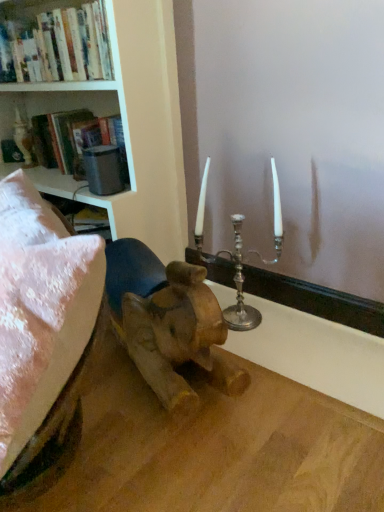
Question: Does white painted wood bookcase at upper left lie behind silver metallic candlestick at upper center?

Choices:
 (A) yes
 (B) no

Answer: (B)

Question: From a real-world perspective, is white painted wood bookcase at upper left on silver metallic candlestick at upper center?

Choices:
 (A) yes
 (B) no

Answer: (A)

Question: Is white painted wood bookcase at upper left next to silver metallic candlestick at upper center?

Choices:
 (A) no
 (B) yes

Answer: (A)

Question: Is silver metallic candlestick at upper center inside white painted wood bookcase at upper left?

Choices:
 (A) yes
 (B) no

Answer: (B)

Question: Considering the relative sizes of white painted wood bookcase at upper left and silver metallic candlestick at upper center in the image provided, is white painted wood bookcase at upper left smaller than silver metallic candlestick at upper center?

Choices:
 (A) no
 (B) yes

Answer: (A)

Question: Is white painted wood bookcase at upper left looking in the opposite direction of silver metallic candlestick at upper center?

Choices:
 (A) yes
 (B) no

Answer: (B)

Question: Is silver metallic candle holder at center wider than white painted wood bookcase at upper left?

Choices:
 (A) no
 (B) yes

Answer: (A)

Question: Is white painted wood bookcase at upper left at the back of silver metallic candle holder at center?

Choices:
 (A) yes
 (B) no

Answer: (B)

Question: Is white painted wood bookcase at upper left inside silver metallic candle holder at center?

Choices:
 (A) no
 (B) yes

Answer: (A)

Question: From the image's perspective, is silver metallic candle holder at center below white painted wood bookcase at upper left?

Choices:
 (A) yes
 (B) no

Answer: (A)

Question: Can you confirm if silver metallic candle holder at center is shorter than white painted wood bookcase at upper left?

Choices:
 (A) yes
 (B) no

Answer: (A)

Question: Is silver metallic candle holder at center smaller than white painted wood bookcase at upper left?

Choices:
 (A) yes
 (B) no

Answer: (A)

Question: Is hardcover books at upper left at the back of matte black bookshelf at upper left?

Choices:
 (A) no
 (B) yes

Answer: (A)